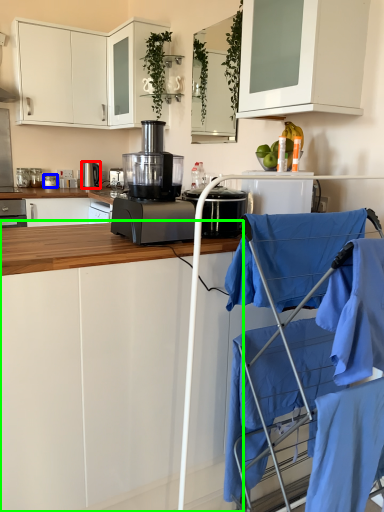
Question: Which object is positioned closest to home appliance (highlighted by a red box)? Select from kitchen appliance (highlighted by a blue box) and cabinetry (highlighted by a green box).

Choices:
 (A) kitchen appliance
 (B) cabinetry

Answer: (A)